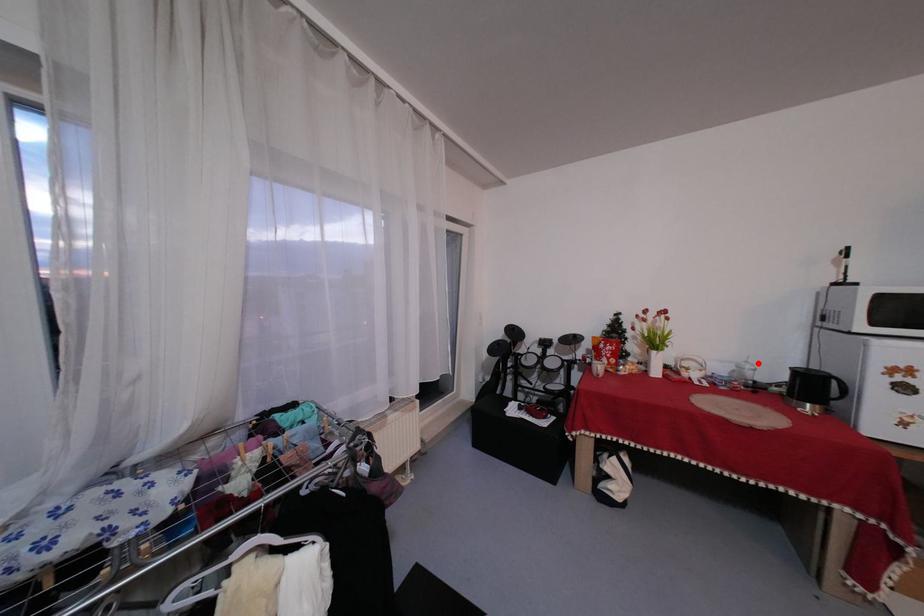
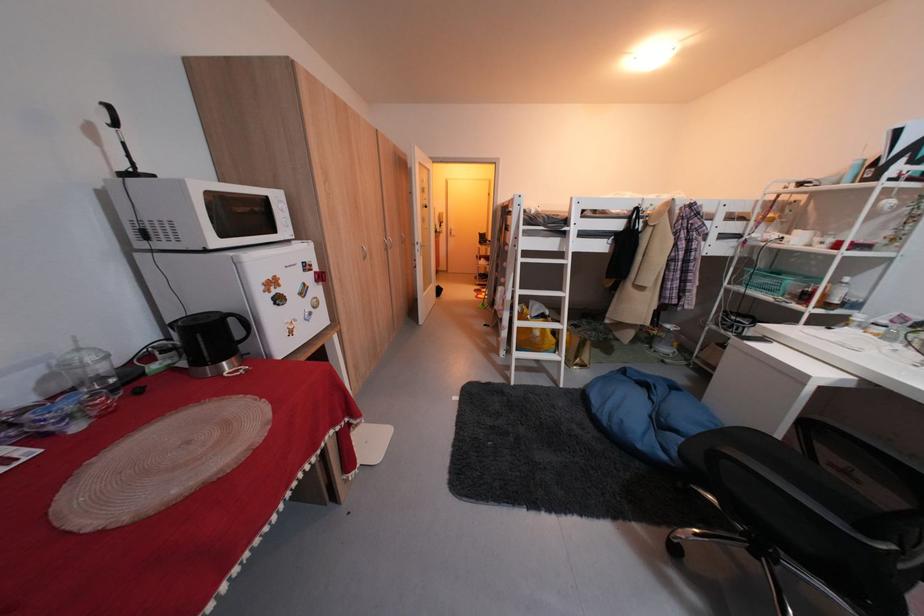
Find the pixel in the second image that matches the highlighted location in the first image.

(91, 351)